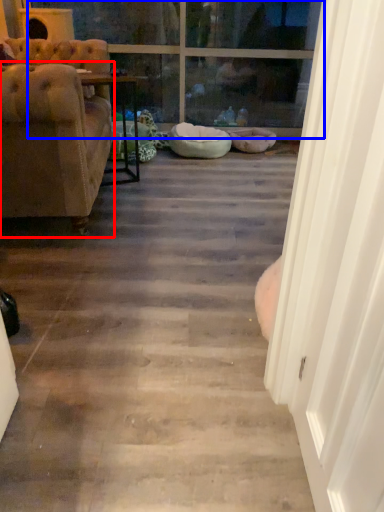
Question: Among these objects, which one is nearest to the camera, chair (highlighted by a red box) or window (highlighted by a blue box)?

Choices:
 (A) chair
 (B) window

Answer: (A)